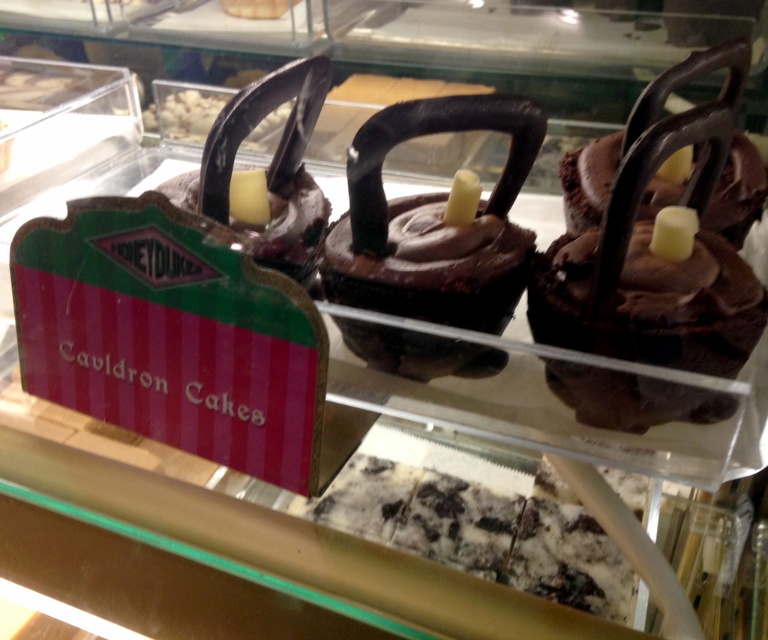
Question: Is chocolatesmoothcupcake at center further to camera compared to chocolate matte kettlebell at center?

Choices:
 (A) yes
 (B) no

Answer: (A)

Question: Can you confirm if chocolatesmoothcupcake at center is wider than chocolate matte kettlebell at center?

Choices:
 (A) no
 (B) yes

Answer: (B)

Question: Does chocolatesmoothcupcake at center have a lesser width compared to chocolate matte kettlebell at center?

Choices:
 (A) no
 (B) yes

Answer: (A)

Question: Among these points, which one is nearest to the camera?

Choices:
 (A) (371, 140)
 (B) (222, 234)

Answer: (B)